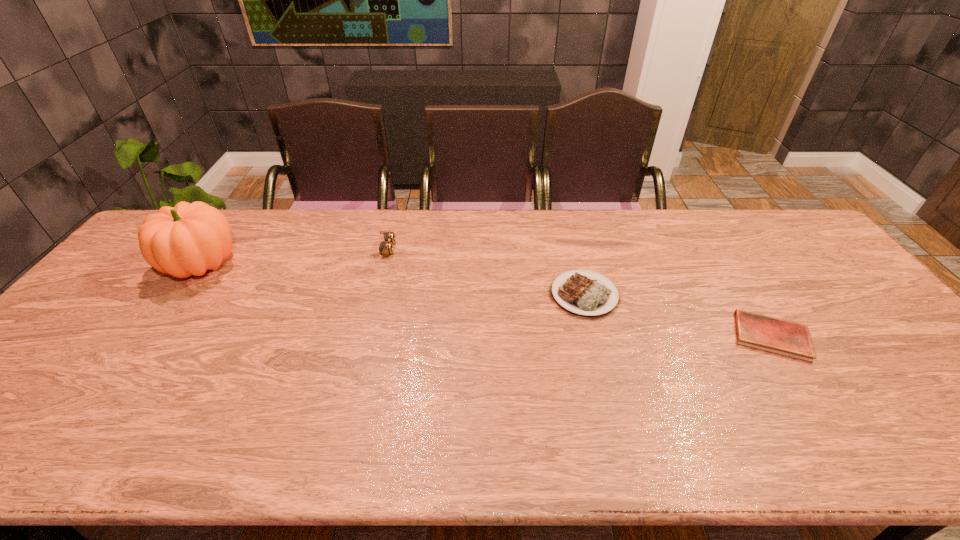
The width and height of the screenshot is (960, 540). Identify the location of pumpkin. (188, 239).

You are a GUI agent. You are given a task and a screenshot of the screen. Output one action in this format:
    pyautogui.click(x=<x>, y=<y>)
    Task: Click on the tallest object
    
    Given the screenshot: What is the action you would take?
    pyautogui.click(x=188, y=239)

You are a GUI agent. You are given a task and a screenshot of the screen. Output one action in this format:
    pyautogui.click(x=<x>, y=<y>)
    Task: Click on the second object from left to right
    The width and height of the screenshot is (960, 540).
    Given the screenshot: What is the action you would take?
    pyautogui.click(x=385, y=248)

Find the location of a particular element. This screenshot has height=540, width=960. the third shortest object is located at coordinates (385, 248).

You are a GUI agent. You are given a task and a screenshot of the screen. Output one action in this format:
    pyautogui.click(x=<x>, y=<y>)
    Task: Click on the plate
    Image resolution: width=960 pixels, height=540 pixels.
    Given the screenshot: What is the action you would take?
    [x=584, y=295]

Where is `the second shortest object`? The height and width of the screenshot is (540, 960). the second shortest object is located at coordinates (584, 295).

Locate an element on the screen. The width and height of the screenshot is (960, 540). the rightmost object is located at coordinates (770, 334).

Find the location of a particular element. Image resolution: width=960 pixels, height=540 pixels. diary is located at coordinates (770, 334).

At what (x,y) coordinates should I click in order to perform the action: click on vacant space located on the front of the tallest object. Please return your answer as a coordinate pair (x, y). Looking at the image, I should click on (164, 317).

Identify the location of vacant space located through the lenses of the goggles. (432, 249).